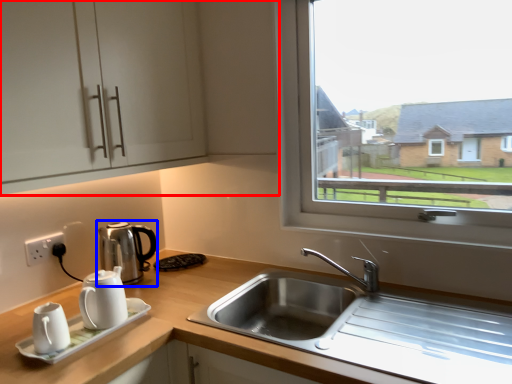
Question: Which of the following is the closest to the observer, cabinetry (highlighted by a red box) or coffeepot (highlighted by a blue box)?

Choices:
 (A) cabinetry
 (B) coffeepot

Answer: (A)